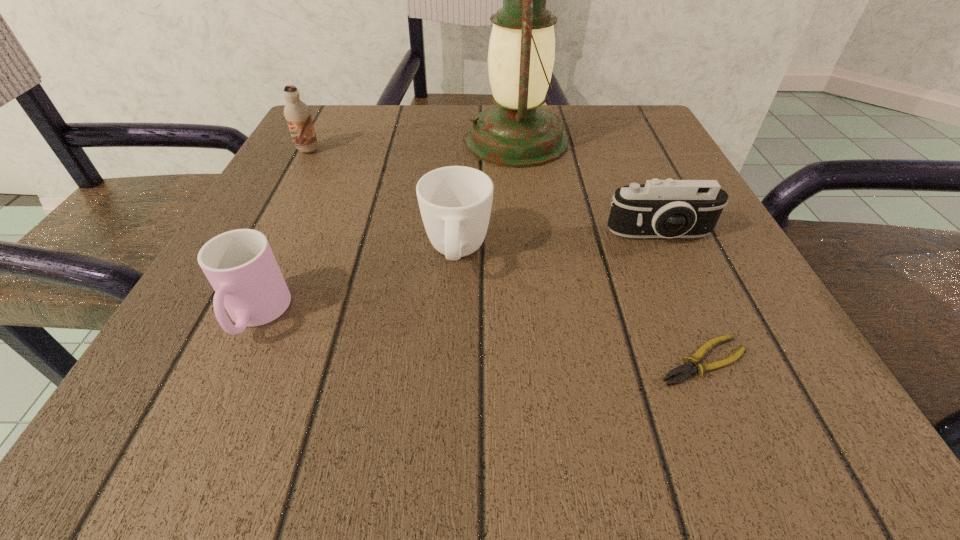
At what (x,y) coordinates should I click in order to perform the action: click on vacant space located 0.130m with the handle on the side of the right cup. Please return your answer as a coordinate pair (x, y). This screenshot has width=960, height=540. Looking at the image, I should click on coord(450,375).

Identify the location of vacant point located on the front lens of the camera. The image size is (960, 540). (684, 289).

You are a GUI agent. You are given a task and a screenshot of the screen. Output one action in this format:
    pyautogui.click(x=<x>, y=<y>)
    Task: Click on the vacant region located 0.350m on the back of the shortest object
    The width and height of the screenshot is (960, 540).
    Given the screenshot: What is the action you would take?
    pyautogui.click(x=625, y=178)

The image size is (960, 540). Find the location of `lantern located in the far edge section of the desktop`. lantern located in the far edge section of the desktop is located at coordinates (517, 133).

I want to click on chocolate milk located in the far edge section of the desktop, so click(x=298, y=115).

I want to click on object positioned at the near edge, so click(x=686, y=370).

Locate an element on the screen. The height and width of the screenshot is (540, 960). chocolate milk located at the left edge is located at coordinates (298, 115).

Identify the location of cup present at the left edge. (240, 265).

Identify the location of camera that is at the right edge. The image size is (960, 540). (669, 208).

The height and width of the screenshot is (540, 960). I want to click on pliers that is at the right edge, so 686,370.